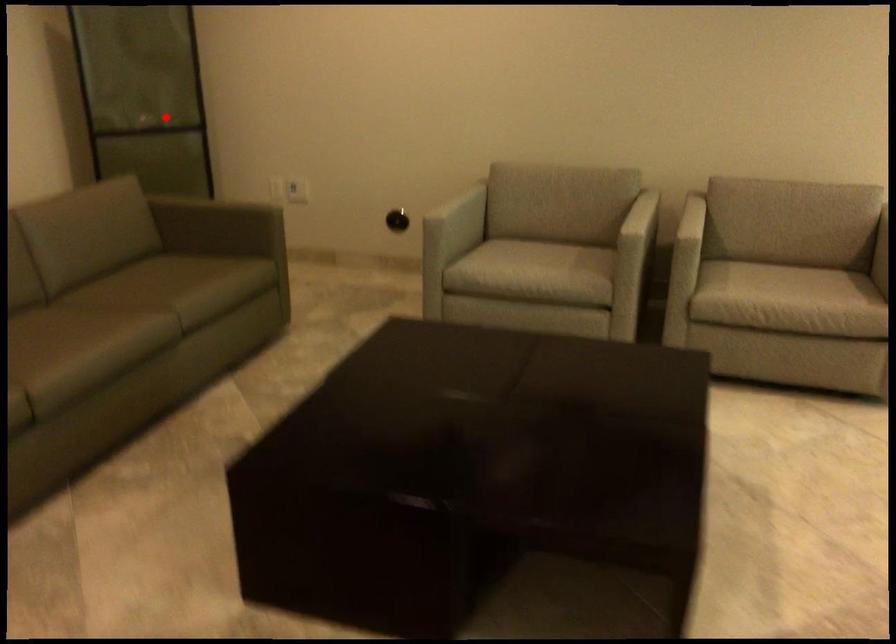
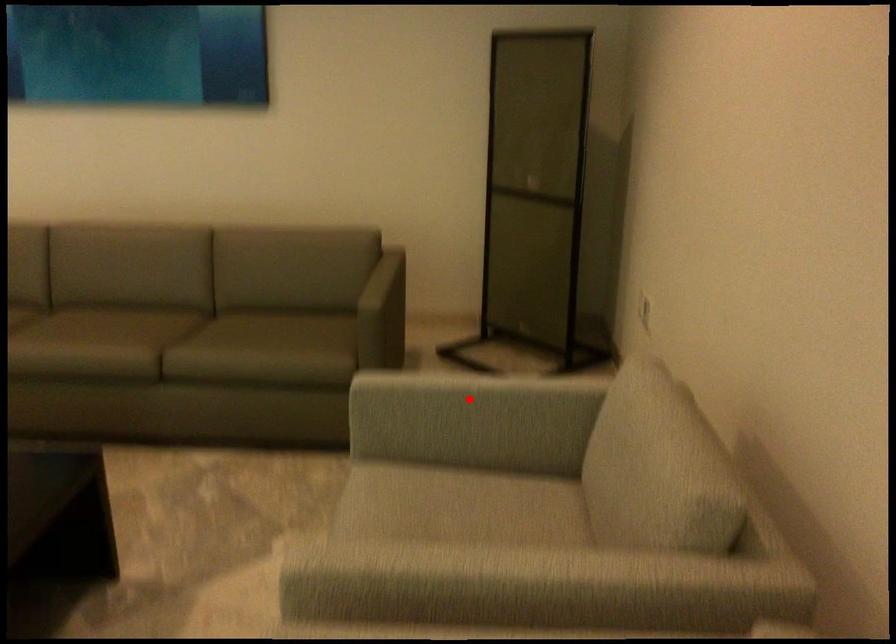
I am providing you with two images of the same scene from different viewpoints. A red point is marked on the first image and another point is marked on the second image. Are the points marked in image1 and image2 representing the same 3D position?

No